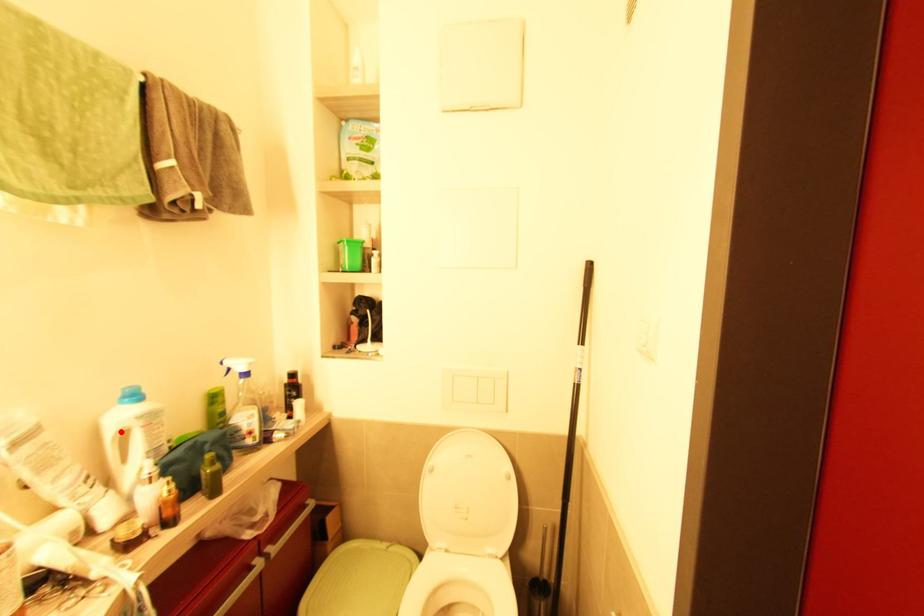
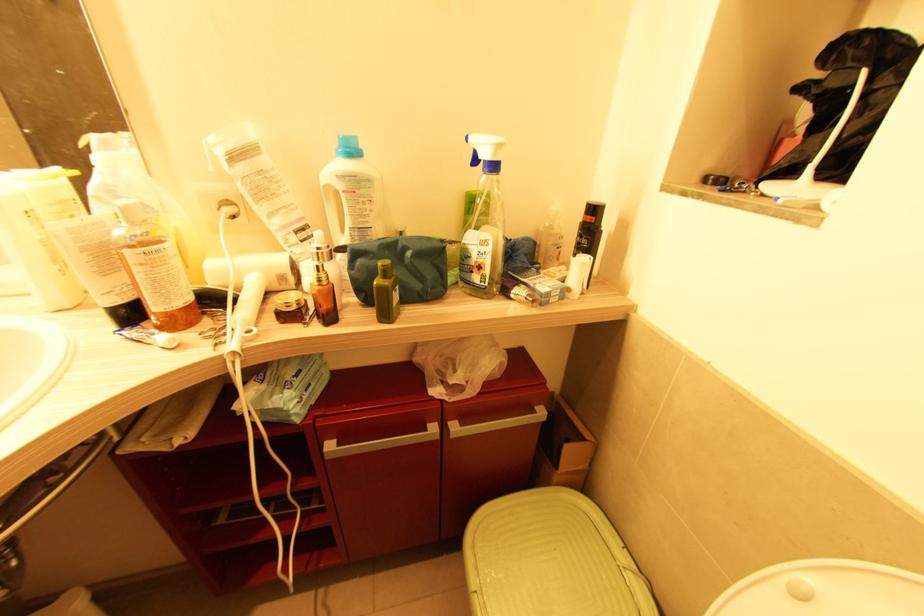
In the second image, find the point that corresponds to the highlighted location in the first image.

(329, 188)